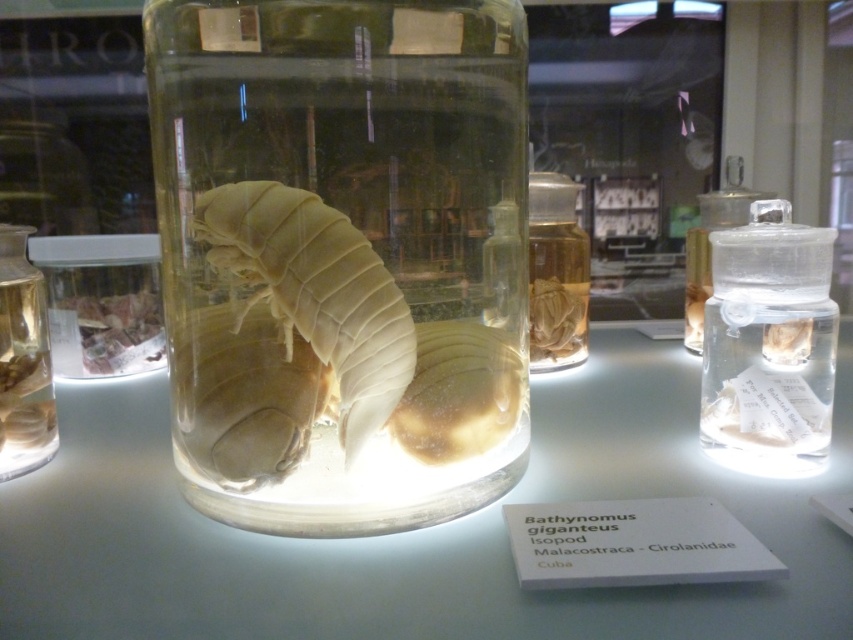
You are a researcher examining the scientific display. You need to place a heavy equipment box on the transparent glass table at center. Is the table at the specified coordinates the correct one to use?

The transparent glass table at center is located at point (412, 531), so yes, it is the correct table to place the equipment box on.

You are a museum visitor standing in front of the display. You want to take a photo of the translucent white isopod at center without any obstructions. Is the transparent glass table at center blocking your view of the isopod?

A: The transparent glass table at center is below the translucent white isopod at center, so it won not block your view of the isopod.